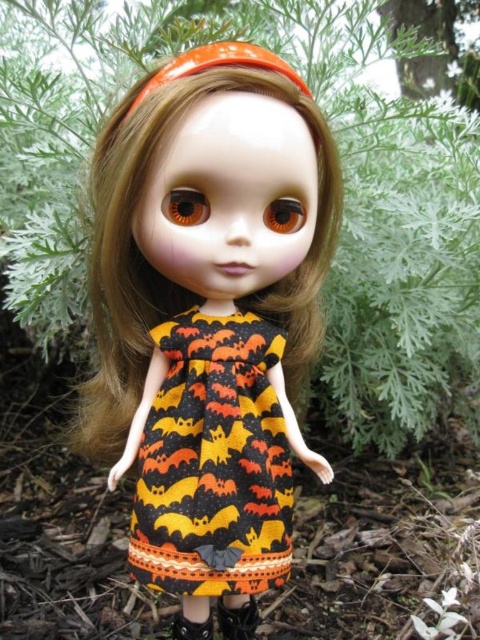
In the scene shown: You are a gardener who wants to water the green leafy plant at center and the black leather shoe at lower center. Which object should you water first if you want to start with the one closest to you?

Answer: The green leafy plant at center is closer to you than the black leather shoe at lower center, so you should water the green leafy plant at center first.

You are a photographer setting up a shot of the doll. You want to ensure the orange bat print fabric dress at center is fully visible. Should you adjust the green leafy plant at center to a different position?

The green leafy plant at center is positioned over orange bat print fabric dress at center, so yes, you should move the green leafy plant at center to reveal the dress.

You are a character in a video game and need to step on the black leather shoe at lower center without hitting the green leafy plant at center. Is this possible?

The green leafy plant at center is above the black leather shoe at lower center, so stepping on the black leather shoe at lower center would not hit the green leafy plant at center.